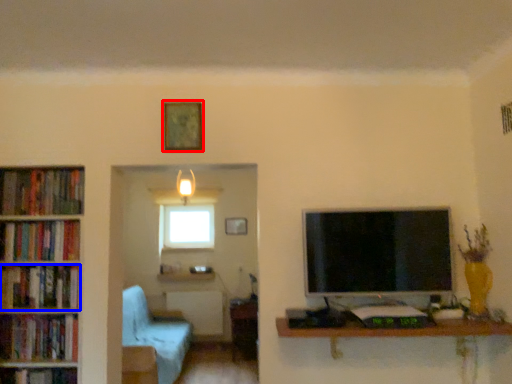
Question: Among these objects, which one is farthest to the camera, picture frame (highlighted by a red box) or book (highlighted by a blue box)?

Choices:
 (A) picture frame
 (B) book

Answer: (B)